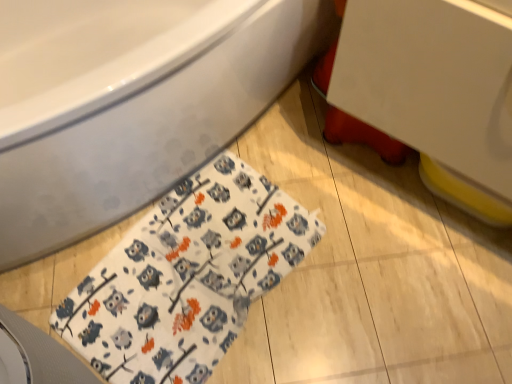
Question: In the image, is white fabric with owl pattern at lower left positioned in front of or behind white glossy sink at upper right?

Choices:
 (A) behind
 (B) front

Answer: (A)

Question: Looking at the image, does white fabric with owl pattern at lower left seem bigger or smaller compared to white glossy sink at upper right?

Choices:
 (A) small
 (B) big

Answer: (A)

Question: Based on their relative distances, which object is farther from the white glossy sink at upper right?

Choices:
 (A) white fabric with owl pattern at lower left
 (B) white glossy bathtub at upper left

Answer: (A)

Question: Estimate the real-world distances between objects in this image. Which object is closer to the white glossy bathtub at upper left?

Choices:
 (A) white glossy sink at upper right
 (B) white fabric with owl pattern at lower left

Answer: (B)